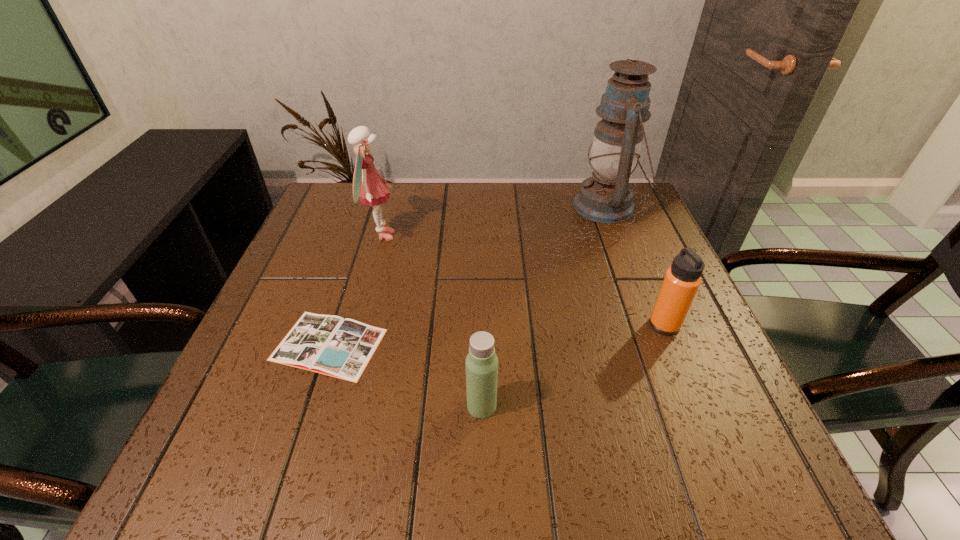
The height and width of the screenshot is (540, 960). I want to click on free space between the left thermos bottle and the fourth shortest object, so click(x=431, y=320).

Locate an element on the screen. unoccupied area between the tallest object and the book is located at coordinates (468, 275).

At what (x,y) coordinates should I click in order to perform the action: click on vacant area between the book and the left thermos bottle. Please return your answer as a coordinate pair (x, y). Looking at the image, I should click on (405, 375).

Image resolution: width=960 pixels, height=540 pixels. I want to click on unoccupied area between the fourth shortest object and the oil lamp, so click(x=493, y=221).

Locate which object ranks fourth in proximity to the farther thermos bottle. Please provide its 2D coordinates. Your answer should be formatted as a tuple, i.e. [(x, y)], where the tuple contains the x and y coordinates of a point satisfying the conditions above.

[(368, 184)]

You are a GUI agent. You are given a task and a screenshot of the screen. Output one action in this format:
    pyautogui.click(x=<x>, y=<y>)
    Task: Click on the object that is the closest to the oil lamp
    This screenshot has height=540, width=960.
    Given the screenshot: What is the action you would take?
    pyautogui.click(x=682, y=280)

Find the location of a particular element. This screenshot has width=960, height=540. vacant space that satisfies the following two spatial constraints: 1. on the front-facing side of the doll; 2. on the front side of the shortest object is located at coordinates [350, 345].

Identify the location of free space that satisfies the following two spatial constraints: 1. on the front-facing side of the farther thermos bottle; 2. on the left side of the second tallest object. Image resolution: width=960 pixels, height=540 pixels. (356, 325).

The height and width of the screenshot is (540, 960). Identify the location of vacant space that satisfies the following two spatial constraints: 1. on the front-facing side of the nearer thermos bottle; 2. on the right side of the doll. (334, 406).